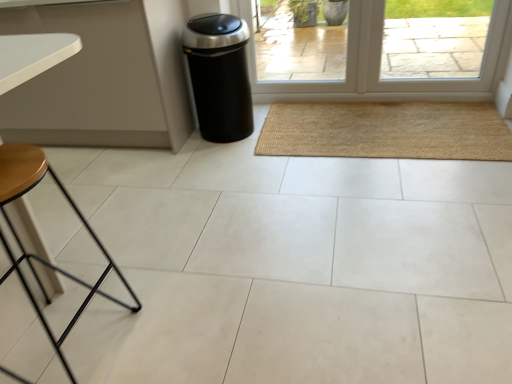
This screenshot has height=384, width=512. I want to click on free space to the right of wooden stool at lower left, so click(184, 326).